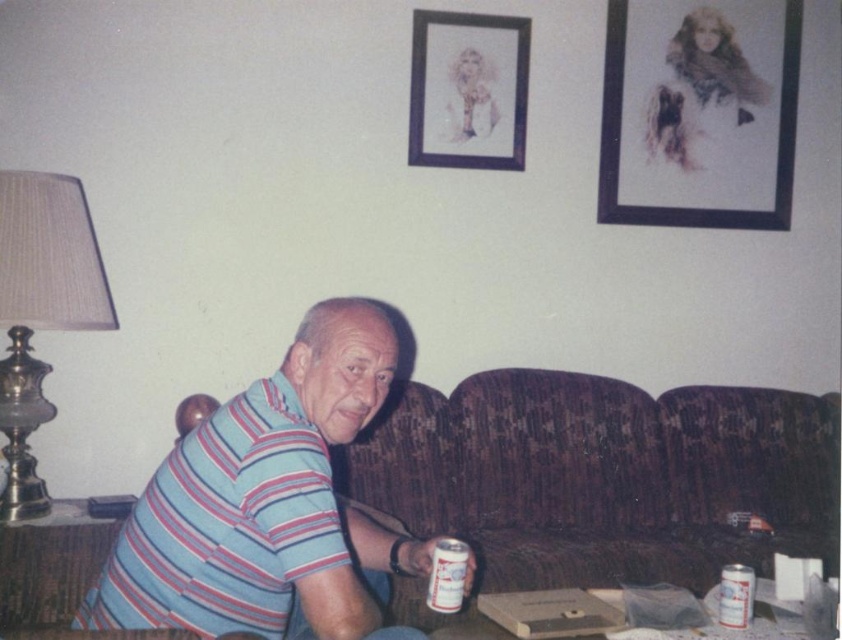
Locate an element on the screen. This screenshot has height=640, width=842. metallic brass lampshade at left is located at coordinates (41, 310).

The width and height of the screenshot is (842, 640). Identify the location of metallic brass lampshade at left. (41, 310).

Which is in front, point (632, 410) or point (491, 128)?

Positioned in front is point (632, 410).

Does point (600, 468) lie behind point (472, 81)?

That is False.

Between point (769, 417) and point (501, 33), which one is positioned in front?

Point (501, 33) is more forward.

Where is `brown fabric couch at center`? The width and height of the screenshot is (842, 640). brown fabric couch at center is located at coordinates (601, 476).

Is matte black picture frame at upper center wider than white matte can at lower right?

Yes, matte black picture frame at upper center is wider than white matte can at lower right.

Based on the photo, can you confirm if matte black picture frame at upper center is thinner than white matte can at lower right?

In fact, matte black picture frame at upper center might be wider than white matte can at lower right.

Locate an element on the screen. The width and height of the screenshot is (842, 640). matte black picture frame at upper center is located at coordinates (467, 90).